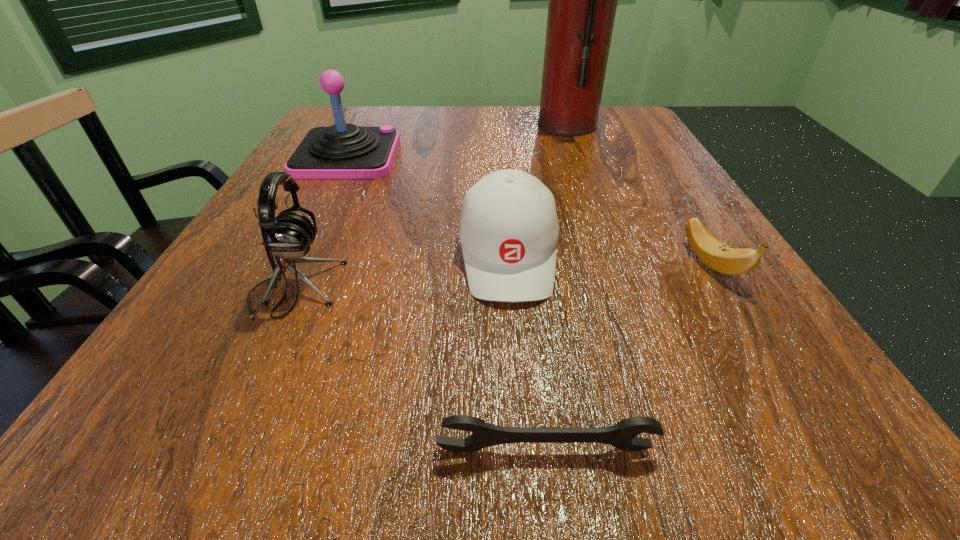
In order to click on vacant area that lies between the earphone and the nearest object in this screenshot , I will do `click(420, 369)`.

The image size is (960, 540). Identify the location of vacant region between the tallest object and the earphone. (431, 207).

At what (x,y) coordinates should I click in order to perform the action: click on vacant area between the joystick and the fire extinguisher. Please return your answer as a coordinate pair (x, y). The width and height of the screenshot is (960, 540). Looking at the image, I should click on (457, 140).

Find the location of a particular element. The width and height of the screenshot is (960, 540). free space between the nearest object and the earphone is located at coordinates (420, 369).

This screenshot has height=540, width=960. Find the location of `free space between the wrench and the tallest object`. free space between the wrench and the tallest object is located at coordinates (557, 287).

I want to click on vacant area that lies between the wrench and the tallest object, so click(557, 287).

Image resolution: width=960 pixels, height=540 pixels. Find the location of `empty space between the third shortest object and the earphone`. empty space between the third shortest object and the earphone is located at coordinates (401, 272).

Locate an element on the screen. object that is the third closest to the earphone is located at coordinates (342, 151).

Where is `object that is the second closest to the earphone`? The image size is (960, 540). object that is the second closest to the earphone is located at coordinates (621, 435).

The image size is (960, 540). I want to click on vacant space that satisfies the following two spatial constraints: 1. on the back side of the earphone; 2. forward from the base of the joystick, so click(357, 156).